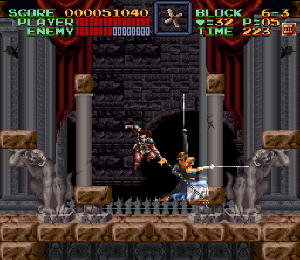
Where is `pedestal statue on left`? The image size is (300, 260). pedestal statue on left is located at coordinates (54, 215).